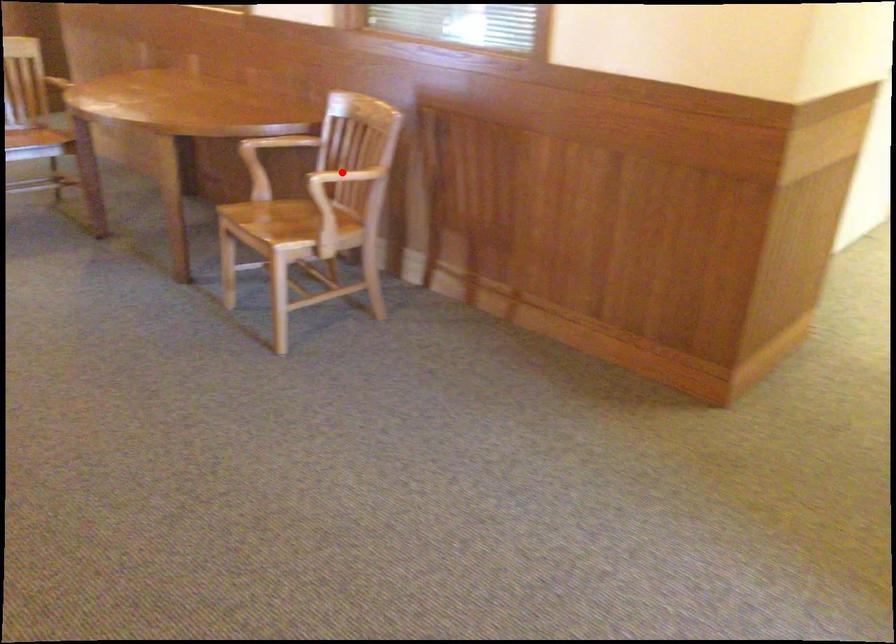
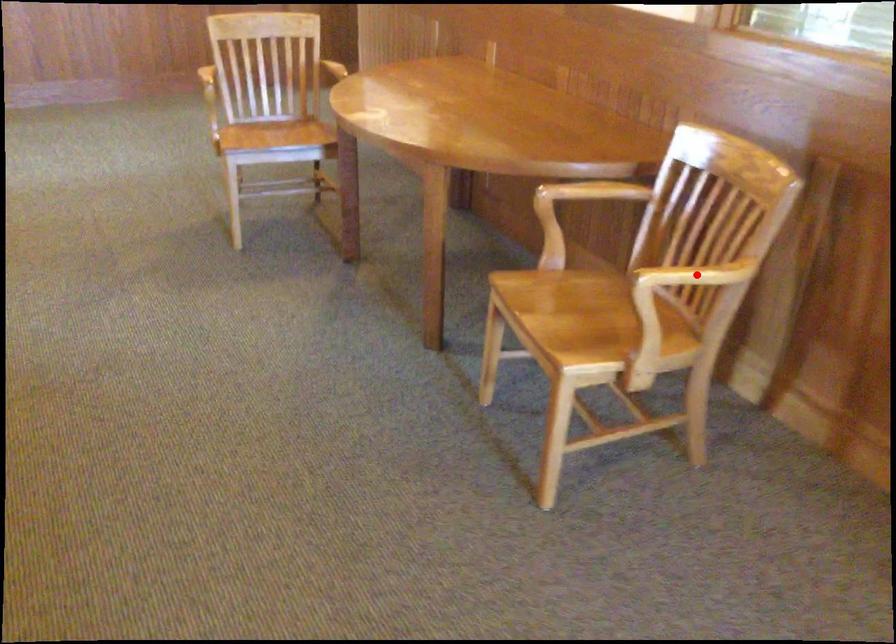
I am providing you with two images of the same scene from different viewpoints. A red point is marked on the first image and another point is marked on the second image. Is the red point in image1 aligned with the point shown in image2?

Yes